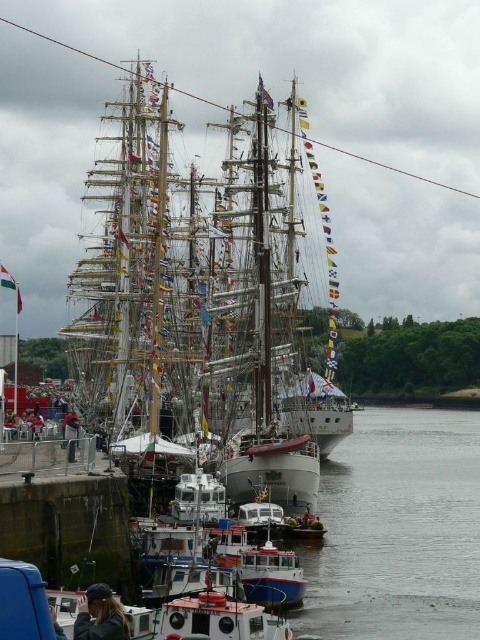
Is point (119, 195) positioned before point (96, 616)?

No, it is not.

Measure the distance between point (191,284) and camera.

The distance of point (191,284) from camera is 190.07 meters.

This screenshot has width=480, height=640. What are the coordinates of `white wooden ship at center` in the screenshot? It's located at click(207, 304).